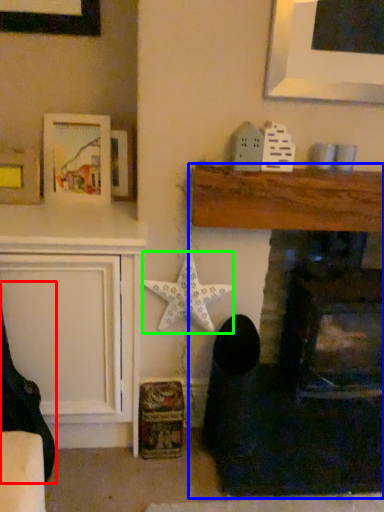
Question: Based on their relative distances, which object is farther from rocking chair (highlighted by a red box)? Choose from fireplace (highlighted by a blue box) and starfish (highlighted by a green box).

Choices:
 (A) fireplace
 (B) starfish

Answer: (A)